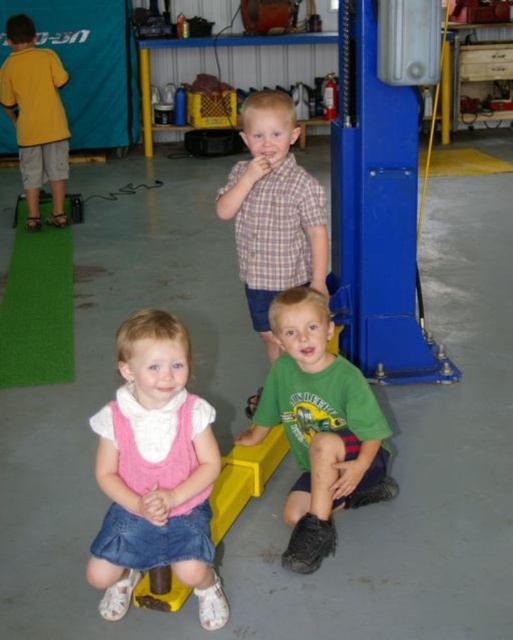
Question: Is pink knitted vest at center bigger than matte yellow shirt at upper left?

Choices:
 (A) no
 (B) yes

Answer: (A)

Question: Which object appears closest to the camera in this image?

Choices:
 (A) matte yellow shirt at upper left
 (B) plaid shirt at center
 (C) pink knitted vest at center

Answer: (C)

Question: Is pink knitted vest at center wider than plaid shirt at center?

Choices:
 (A) yes
 (B) no

Answer: (B)

Question: Which of the following is the farthest from the observer?

Choices:
 (A) click(x=286, y=253)
 (B) click(x=372, y=499)
 (C) click(x=13, y=80)

Answer: (C)

Question: Is green matte shirt at lower center positioned behind plaid shirt at center?

Choices:
 (A) no
 (B) yes

Answer: (A)

Question: Among these objects, which one is nearest to the camera?

Choices:
 (A) green matte shirt at lower center
 (B) plaid shirt at center

Answer: (A)